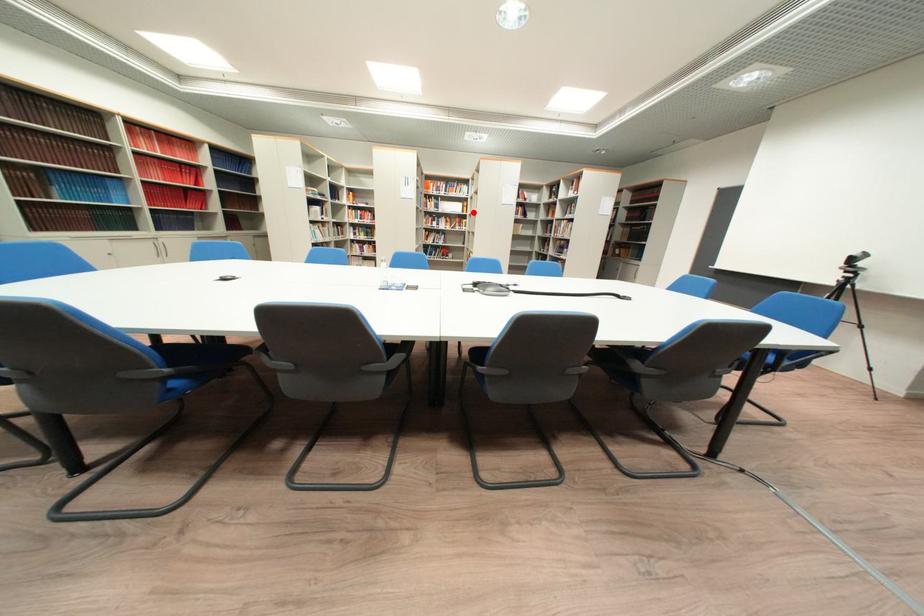
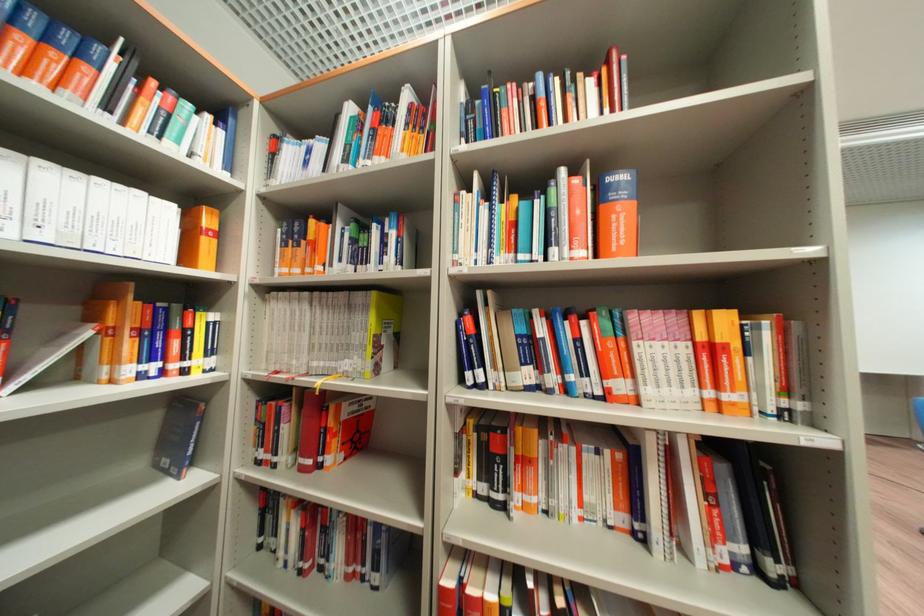
Find the pixel in the second image that matches the highlighted location in the first image.

(198, 260)